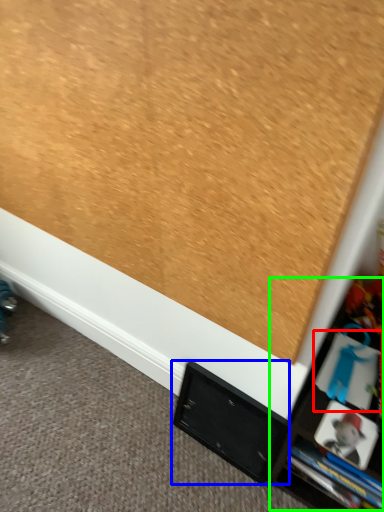
Question: Based on their relative distances, which object is farther from book (highlighted by a red box)? Choose from cabinet (highlighted by a blue box) and tv cabinet (highlighted by a green box).

Choices:
 (A) cabinet
 (B) tv cabinet

Answer: (A)